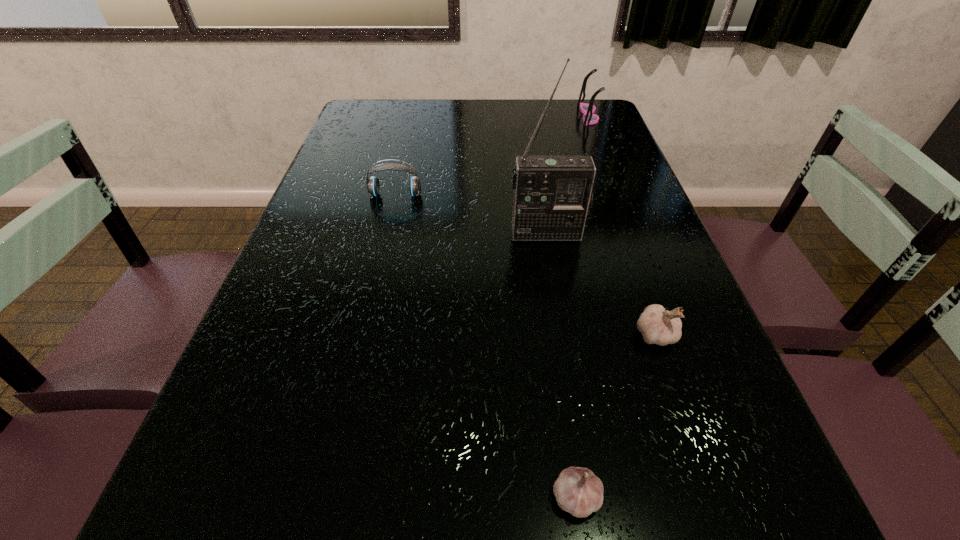
What are the coordinates of `vacant area situated on the display of the tallest object` in the screenshot? It's located at (561, 315).

Identify the location of vacant space located on the front of the spectacles. (616, 186).

At what (x,y) coordinates should I click in order to perform the action: click on vacant space located 0.280m on the ear cups of the leftmost object. Please return your answer as a coordinate pair (x, y). The width and height of the screenshot is (960, 540). Looking at the image, I should click on (376, 278).

The image size is (960, 540). Find the location of `free region located 0.120m on the back of the taller garlic`. free region located 0.120m on the back of the taller garlic is located at coordinates (634, 274).

This screenshot has width=960, height=540. Find the location of `free space located on the back of the shorter garlic`. free space located on the back of the shorter garlic is located at coordinates (560, 385).

At what (x,y) coordinates should I click in order to perform the action: click on object that is at the far edge. Please return your answer as a coordinate pair (x, y). Image resolution: width=960 pixels, height=540 pixels. Looking at the image, I should click on (588, 109).

This screenshot has height=540, width=960. I want to click on object that is at the left edge, so click(x=373, y=186).

This screenshot has width=960, height=540. Identify the location of spectacles at the right edge. (588, 109).

Locate an element on the screen. garlic at the right edge is located at coordinates (657, 326).

Locate an element on the screen. The width and height of the screenshot is (960, 540). object that is at the far right corner is located at coordinates (588, 109).